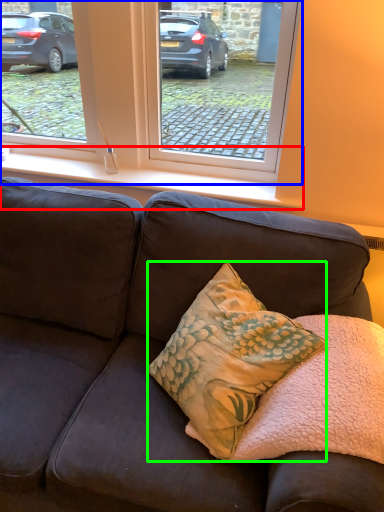
Question: Which object is positioned farthest from window sill (highlighted by a red box)? Select from window (highlighted by a blue box) and pillow (highlighted by a green box).

Choices:
 (A) window
 (B) pillow

Answer: (B)